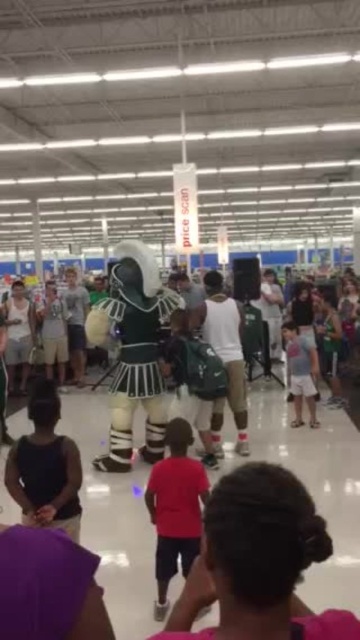
Question: Is red matte shirt at center in front of light blue denim shorts at center?

Choices:
 (A) yes
 (B) no

Answer: (A)

Question: Can you confirm if red matte shirt at center is positioned above light blue denim shorts at center?

Choices:
 (A) no
 (B) yes

Answer: (A)

Question: Among these objects, which one is farthest from the camera?

Choices:
 (A) light blue denim shorts at center
 (B) red matte shirt at center

Answer: (A)

Question: Can you confirm if red matte shirt at center is positioned above light blue denim shorts at center?

Choices:
 (A) yes
 (B) no

Answer: (B)